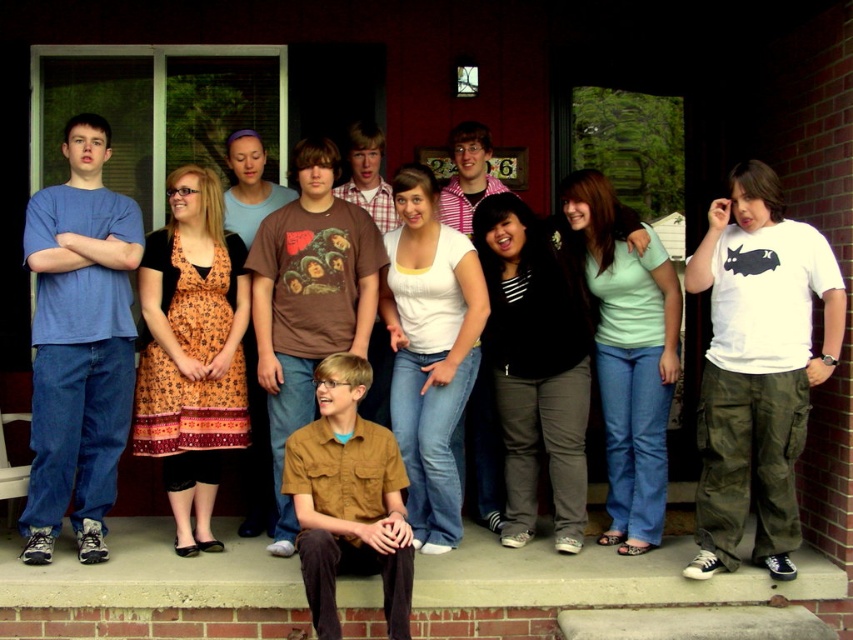
Does white matte t-shirt at center appear under brown cotton shirt at center?

No.

Locate an element on the screen. white matte t-shirt at center is located at coordinates (758, 368).

Does matte blue t-shirt at left have a lesser width compared to brown cotton shirt at center?

Yes.

Locate an element on the screen. The width and height of the screenshot is (853, 640). matte blue t-shirt at left is located at coordinates (79, 344).

Who is more forward, [97,312] or [312,464]?

Point [312,464] is in front.

Where is `matte blue t-shirt at left`? The height and width of the screenshot is (640, 853). matte blue t-shirt at left is located at coordinates (79, 344).

Who is shorter, white matte t-shirt at center or brown cotton t-shirt at center?

white matte t-shirt at center is shorter.

Is white matte t-shirt at center to the right of brown cotton t-shirt at center from the viewer's perspective?

Correct, you'll find white matte t-shirt at center to the right of brown cotton t-shirt at center.

At what (x,y) coordinates should I click in order to perform the action: click on white matte t-shirt at center. Please return your answer as a coordinate pair (x, y). Looking at the image, I should click on (758, 368).